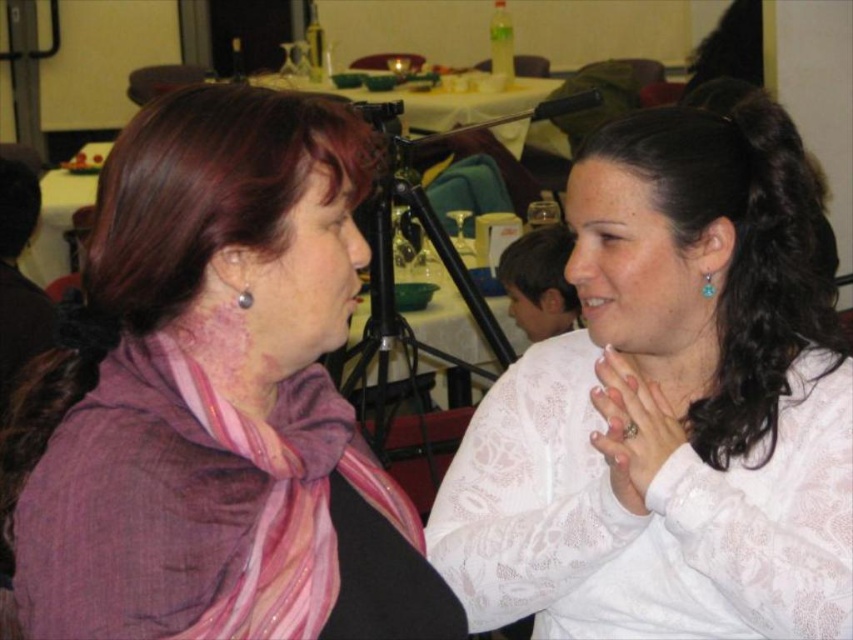
You are at a social event and notice two items with lace patterns. One is a white lace blouse at center and the other is a white lace hand at center. Which lace item is located to the right?

The white lace blouse at center is positioned on the right side of the white lace hand at center, so the blouse is to the right of the hand.

You are standing at a social gathering and want to approach the point marked at coordinates point [610,413]. If you are currently 5 feet away from this point, how much farther do you need to walk to reach it?

The distance of point [610,413] from viewer is 3.46 feet, so you need to walk 5 feet minus 3.46 feet equals 1.54 feet farther to reach it.